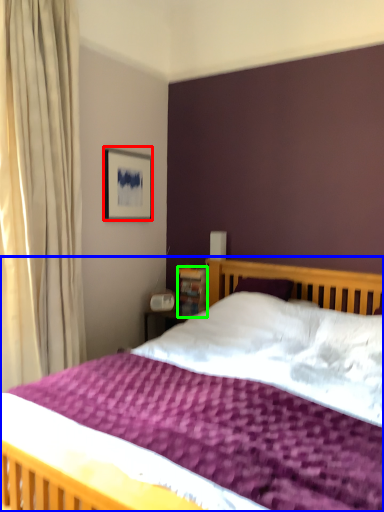
Question: Which object is positioned farthest from picture frame (highlighted by a red box)? Select from bed (highlighted by a blue box) and bookshelf (highlighted by a green box).

Choices:
 (A) bed
 (B) bookshelf

Answer: (A)